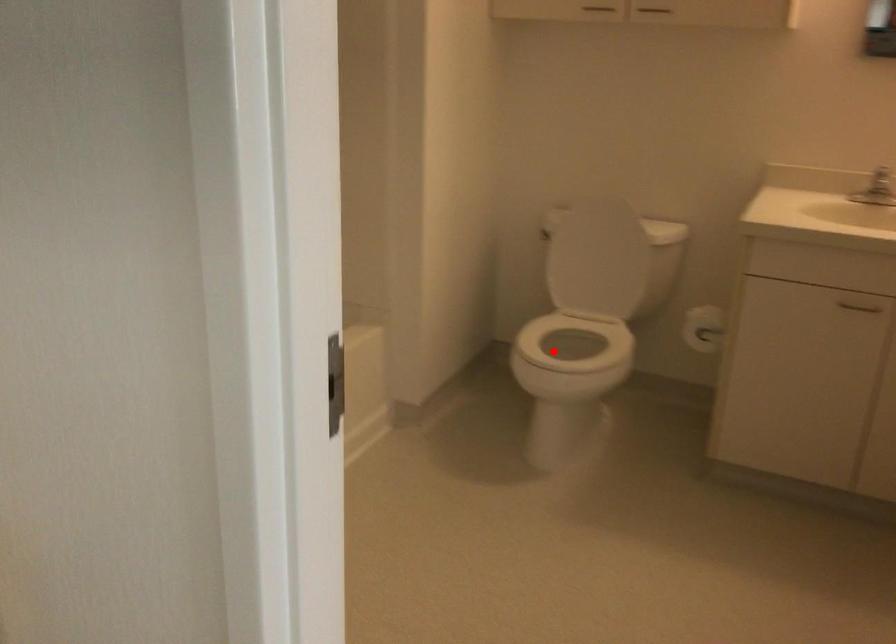
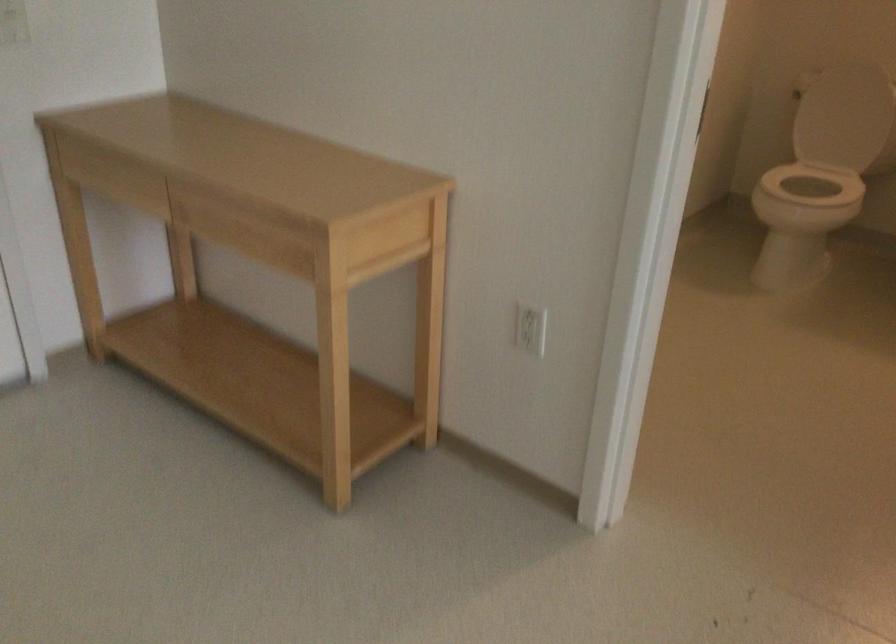
Locate, in the second image, the point that corresponds to the highlighted location in the first image.

(814, 184)